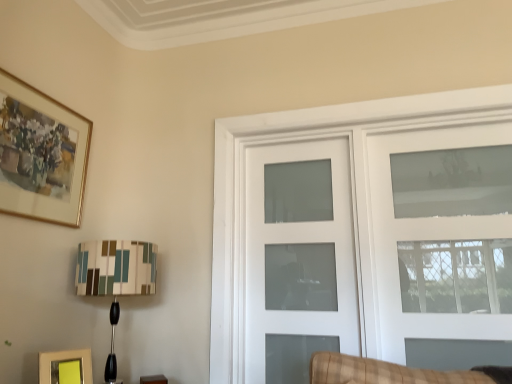
What is the approximate width of multicolored fabric lampshade at lower left?

multicolored fabric lampshade at lower left is 13.79 inches wide.

Where is `gold-framed painting at upper left, the second picture frame from the bottom`? gold-framed painting at upper left, the second picture frame from the bottom is located at coordinates pyautogui.click(x=41, y=154).

This screenshot has width=512, height=384. Identify the location of multicolored fabric lampshade at lower left. (116, 268).

Where is `picture frame that appears below the white frosted glass door at center, which is the first door from left to right (from a real-world perspective)`? This screenshot has height=384, width=512. picture frame that appears below the white frosted glass door at center, which is the first door from left to right (from a real-world perspective) is located at coordinates (66, 367).

Considering the sizes of matte yellow picture frame at lower left, acting as the first picture frame starting from the right, and white frosted glass door at center, which is the first door from left to right, in the image, is matte yellow picture frame at lower left, acting as the first picture frame starting from the right, taller or shorter than white frosted glass door at center, which is the first door from left to right,?

In the image, matte yellow picture frame at lower left, acting as the first picture frame starting from the right, appears to be shorter than white frosted glass door at center, which is the first door from left to right.

Which object is positioned more to the left, matte yellow picture frame at lower left, acting as the 2th picture frame starting from the top, or white frosted glass door at center, which is the first door from left to right?

matte yellow picture frame at lower left, acting as the 2th picture frame starting from the top.

What's the angular difference between matte yellow picture frame at lower left, acting as the first picture frame starting from the right, and white frosted glass door at center, the second door in the right-to-left sequence,'s facing directions?

matte yellow picture frame at lower left, acting as the first picture frame starting from the right, and white frosted glass door at center, the second door in the right-to-left sequence, are facing 63.2 degrees away from each other.

Based on their sizes in the image, would you say gold-framed painting at upper left, the first picture frame viewed from the top, is bigger or smaller than white frosted glass door at center, which is the first door from left to right?

gold-framed painting at upper left, the first picture frame viewed from the top, is smaller than white frosted glass door at center, which is the first door from left to right.

Can you confirm if gold-framed painting at upper left, arranged as the first picture frame when viewed from the left, is positioned to the right of white frosted glass door at center, the second door in the right-to-left sequence?

In fact, gold-framed painting at upper left, arranged as the first picture frame when viewed from the left, is to the left of white frosted glass door at center, the second door in the right-to-left sequence.

Is there a large distance between gold-framed painting at upper left, arranged as the first picture frame when viewed from the left, and white frosted glass door at center, which is the first door from left to right?

Yes, gold-framed painting at upper left, arranged as the first picture frame when viewed from the left, is far from white frosted glass door at center, which is the first door from left to right.

From a real-world perspective, who is located higher, gold-framed painting at upper left, the second picture frame from the bottom, or white frosted glass door at center, which is the first door from left to right?

gold-framed painting at upper left, the second picture frame from the bottom, from a real-world perspective.

In the scene shown: Would you say matte yellow picture frame at lower left, which ranks as the first picture frame in bottom-to-top order, is inside or outside multicolored fabric lampshade at lower left?

matte yellow picture frame at lower left, which ranks as the first picture frame in bottom-to-top order, is outside multicolored fabric lampshade at lower left.

Considering the sizes of matte yellow picture frame at lower left, acting as the 2th picture frame starting from the top, and multicolored fabric lampshade at lower left in the image, is matte yellow picture frame at lower left, acting as the 2th picture frame starting from the top, taller or shorter than multicolored fabric lampshade at lower left?

Considering their sizes, matte yellow picture frame at lower left, acting as the 2th picture frame starting from the top, has less height than multicolored fabric lampshade at lower left.

How many degrees apart are the facing directions of gold-framed painting at upper left, the first picture frame viewed from the top, and matte yellow picture frame at lower left, which ranks as the first picture frame in bottom-to-top order?

There is a 26.9-degree angle between the facing directions of gold-framed painting at upper left, the first picture frame viewed from the top, and matte yellow picture frame at lower left, which ranks as the first picture frame in bottom-to-top order.

Is matte yellow picture frame at lower left, acting as the first picture frame starting from the right, at the back of gold-framed painting at upper left, arranged as the 2th picture frame when viewed from the right?

No, gold-framed painting at upper left, arranged as the 2th picture frame when viewed from the right, is not facing the opposite direction of matte yellow picture frame at lower left, acting as the first picture frame starting from the right.

From a real-world perspective, is gold-framed painting at upper left, arranged as the 2th picture frame when viewed from the right, located beneath matte yellow picture frame at lower left, acting as the 2th picture frame starting from the top?

No, from a real-world perspective, gold-framed painting at upper left, arranged as the 2th picture frame when viewed from the right, is not under matte yellow picture frame at lower left, acting as the 2th picture frame starting from the top.

The width and height of the screenshot is (512, 384). What are the coordinates of `picture frame on the left of the matte yellow picture frame at lower left, acting as the first picture frame starting from the right` in the screenshot? It's located at (41, 154).

Image resolution: width=512 pixels, height=384 pixels. In the image, there is a clear glass door at upper right, the 2th door from the left. In order to click on picture frame below it (from a real-world perspective) in this screenshot , I will do `click(66, 367)`.

Looking at this image, from a real-world perspective, which is physically below, clear glass door at upper right, which ranks as the first door in right-to-left order, or matte yellow picture frame at lower left, acting as the first picture frame starting from the right?

matte yellow picture frame at lower left, acting as the first picture frame starting from the right.

Can you confirm if clear glass door at upper right, which ranks as the first door in right-to-left order, is positioned to the left of matte yellow picture frame at lower left, the second picture frame from the left?

No, clear glass door at upper right, which ranks as the first door in right-to-left order, is not to the left of matte yellow picture frame at lower left, the second picture frame from the left.

In the scene shown: From a real-world perspective, which is physically below, multicolored fabric lampshade at lower left or matte yellow picture frame at lower left, which ranks as the first picture frame in bottom-to-top order?

In real-world perspective, matte yellow picture frame at lower left, which ranks as the first picture frame in bottom-to-top order, is lower.

In the scene shown: Is the surface of multicolored fabric lampshade at lower left in direct contact with matte yellow picture frame at lower left, acting as the first picture frame starting from the right?

There is a gap between multicolored fabric lampshade at lower left and matte yellow picture frame at lower left, acting as the first picture frame starting from the right.

Can you confirm if multicolored fabric lampshade at lower left is smaller than matte yellow picture frame at lower left, acting as the 2th picture frame starting from the top?

No.

At what (x,y) coordinates should I click in order to perform the action: click on picture frame that is the 1st object located in front of the multicolored fabric lampshade at lower left. Please return your answer as a coordinate pair (x, y). The width and height of the screenshot is (512, 384). Looking at the image, I should click on (66, 367).

From the clear glass door at upper right, which ranks as the first door in right-to-left order, count 1st picture frames forward and point to it. Please provide its 2D coordinates.

[(66, 367)]

Does matte yellow picture frame at lower left, acting as the first picture frame starting from the right, have a lesser width compared to clear glass door at upper right, which ranks as the first door in right-to-left order?

No, matte yellow picture frame at lower left, acting as the first picture frame starting from the right, is not thinner than clear glass door at upper right, which ranks as the first door in right-to-left order.

Based on the photo, does matte yellow picture frame at lower left, the second picture frame from the left, appear on the left side of clear glass door at upper right, which ranks as the first door in right-to-left order?

Yes, matte yellow picture frame at lower left, the second picture frame from the left, is to the left of clear glass door at upper right, which ranks as the first door in right-to-left order.

Between matte yellow picture frame at lower left, which ranks as the first picture frame in bottom-to-top order, and clear glass door at upper right, the 2th door from the left, which one has less height?

matte yellow picture frame at lower left, which ranks as the first picture frame in bottom-to-top order, is shorter.

From the matte yellow picture frame at lower left, acting as the first picture frame starting from the right, count 1st door to the right and point to it. Please provide its 2D coordinates.

[(298, 258)]

There is a white frosted glass door at center, which is the first door from left to right. What are the coordinates of `picture frame above it (from a real-world perspective)` in the screenshot? It's located at (41, 154).

When comparing their distances from multicolored fabric lampshade at lower left, does matte yellow picture frame at lower left, the second picture frame from the left, or white frosted glass door at center, the second door in the right-to-left sequence, seem further?

Based on the image, white frosted glass door at center, the second door in the right-to-left sequence, appears to be further to multicolored fabric lampshade at lower left.

From the image, which object appears to be farther from gold-framed painting at upper left, the second picture frame from the bottom, matte yellow picture frame at lower left, acting as the first picture frame starting from the right, or white frosted glass door at center, which is the first door from left to right?

white frosted glass door at center, which is the first door from left to right.

Which object lies nearer to the anchor point clear glass door at upper right, the 2th door from the left, white frosted glass door at center, the second door in the right-to-left sequence, or gold-framed painting at upper left, arranged as the first picture frame when viewed from the left?

The object closer to clear glass door at upper right, the 2th door from the left, is white frosted glass door at center, the second door in the right-to-left sequence.

Estimate the real-world distances between objects in this image. Which object is closer to clear glass door at upper right, the 2th door from the left, gold-framed painting at upper left, the second picture frame from the bottom, or multicolored fabric lampshade at lower left?

Among the two, multicolored fabric lampshade at lower left is located nearer to clear glass door at upper right, the 2th door from the left.

Looking at the image, which one is located further to multicolored fabric lampshade at lower left, matte yellow picture frame at lower left, the second picture frame from the left, or clear glass door at upper right, the 2th door from the left?

The object further to multicolored fabric lampshade at lower left is clear glass door at upper right, the 2th door from the left.

Which object lies further to the anchor point white frosted glass door at center, which is the first door from left to right, gold-framed painting at upper left, arranged as the first picture frame when viewed from the left, or clear glass door at upper right, which ranks as the first door in right-to-left order?

gold-framed painting at upper left, arranged as the first picture frame when viewed from the left.

Estimate the real-world distances between objects in this image. Which object is closer to gold-framed painting at upper left, the second picture frame from the bottom, white frosted glass door at center, which is the first door from left to right, or matte yellow picture frame at lower left, acting as the first picture frame starting from the right?

The object closer to gold-framed painting at upper left, the second picture frame from the bottom, is matte yellow picture frame at lower left, acting as the first picture frame starting from the right.

When comparing their distances from clear glass door at upper right, which ranks as the first door in right-to-left order, does gold-framed painting at upper left, the second picture frame from the bottom, or white frosted glass door at center, which is the first door from left to right, seem further?

Among the two, gold-framed painting at upper left, the second picture frame from the bottom, is located further to clear glass door at upper right, which ranks as the first door in right-to-left order.

In order to click on table lamp between gold-framed painting at upper left, the second picture frame from the bottom, and matte yellow picture frame at lower left, acting as the first picture frame starting from the right, in the vertical direction in this screenshot , I will do `click(116, 268)`.

This screenshot has height=384, width=512. In order to click on door between gold-framed painting at upper left, the second picture frame from the bottom, and clear glass door at upper right, the 2th door from the left, from left to right in this screenshot , I will do `click(298, 258)`.

I want to click on table lamp located between gold-framed painting at upper left, the second picture frame from the bottom, and white frosted glass door at center, which is the first door from left to right, in the left-right direction, so click(116, 268).

This screenshot has height=384, width=512. What are the coordinates of `door between matte yellow picture frame at lower left, which ranks as the first picture frame in bottom-to-top order, and clear glass door at upper right, which ranks as the first door in right-to-left order` in the screenshot? It's located at (298, 258).